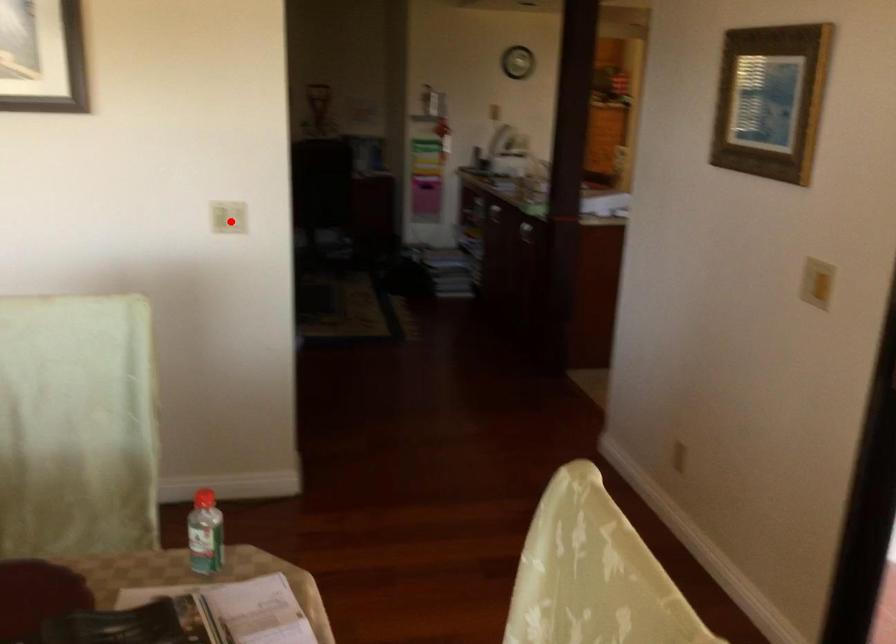
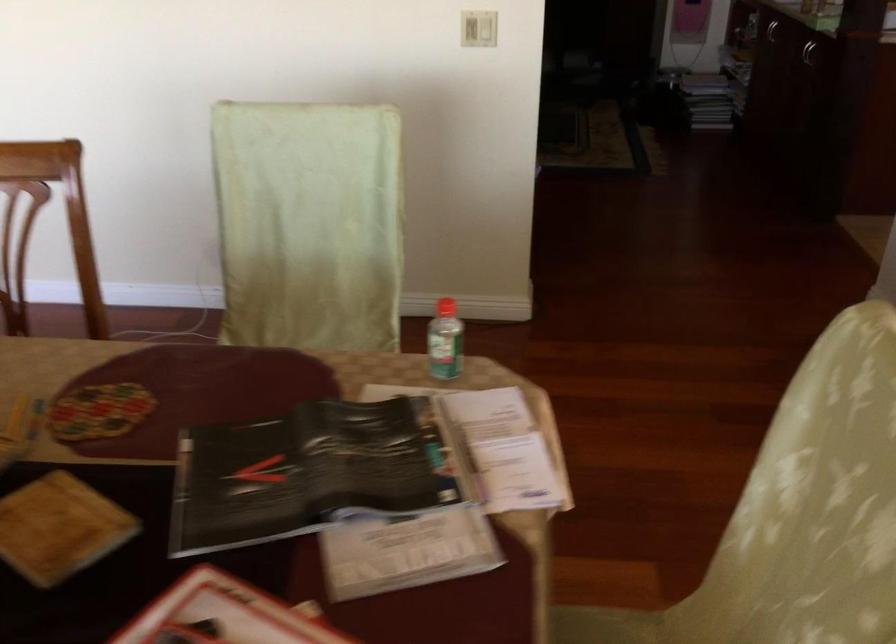
The point at the highlighted location is marked in the first image. Where is the corresponding point in the second image?

(478, 29)